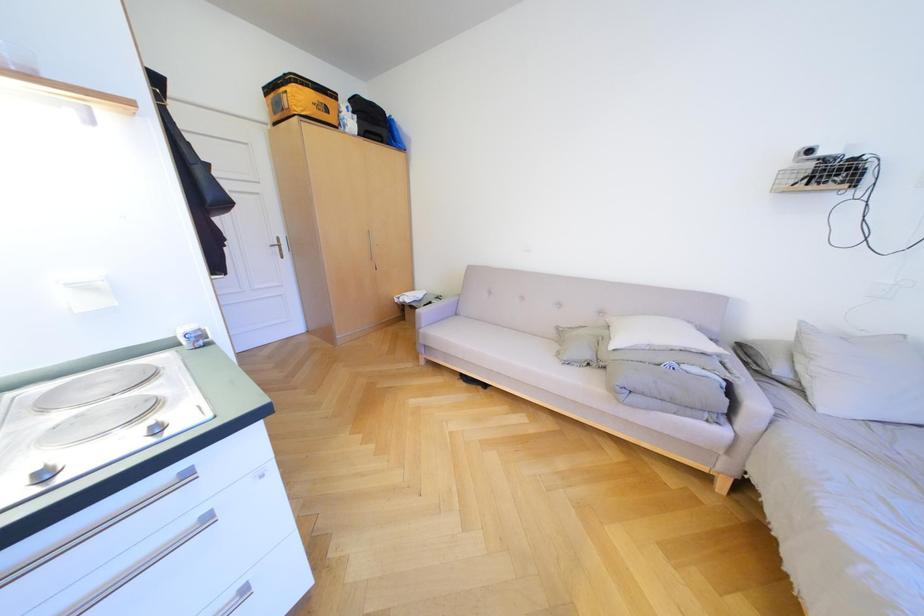
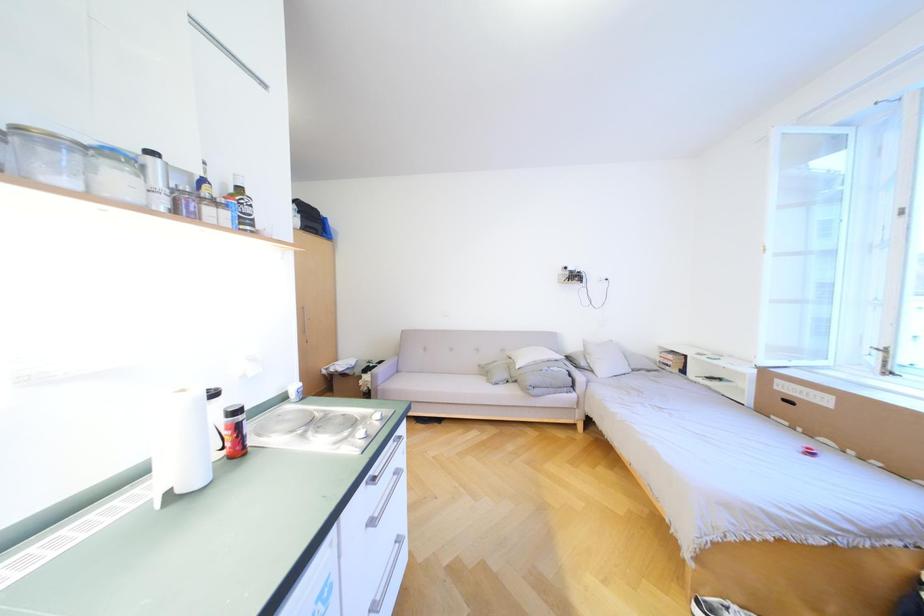
Question: The images are taken continuously from a first-person perspective. In which direction is your viewpoint rotating?

Choices:
 (A) Left
 (B) Right
 (C) Up
 (D) Down

Answer: (B)